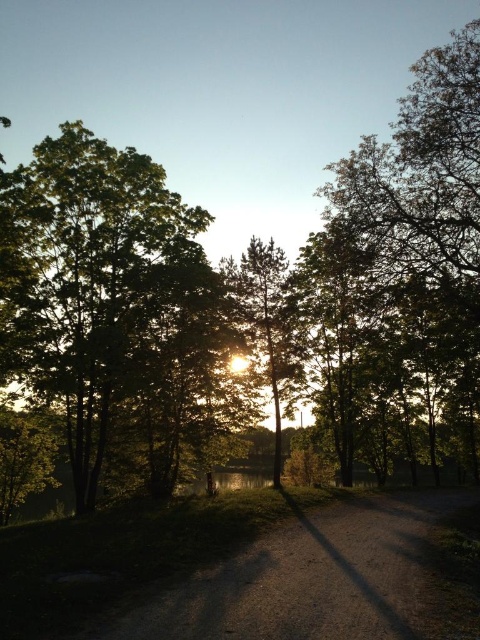
From the picture: Does dirt/gravel path at center appear on the left side of silhouette textured tree at center?

In fact, dirt/gravel path at center is to the right of silhouette textured tree at center.

Between dirt/gravel path at center and silhouette textured tree at center, which one has more height?

silhouette textured tree at center

Who is more distant from viewer, (159, 616) or (288, 285)?

The point (288, 285) is more distant.

This screenshot has height=640, width=480. I want to click on dirt/gravel path at center, so click(311, 577).